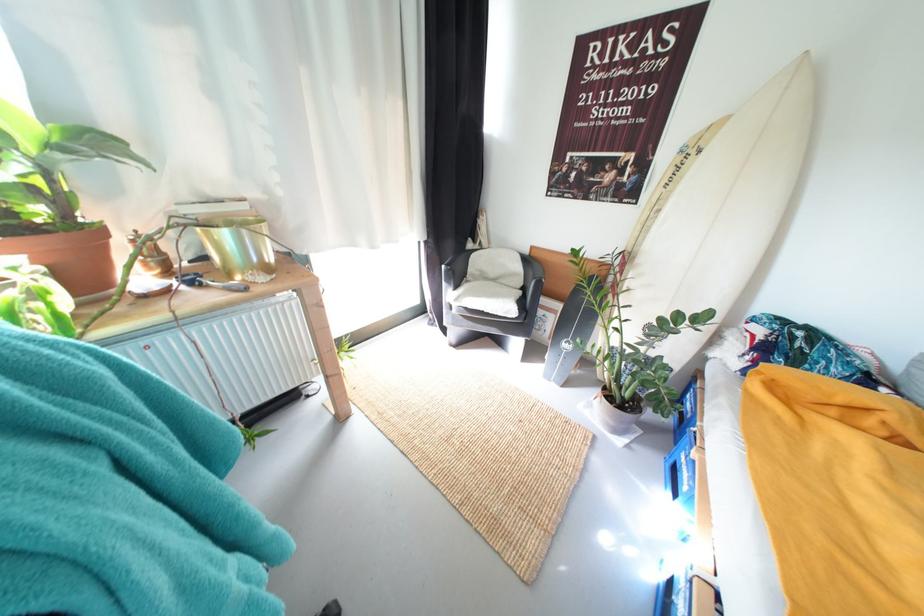
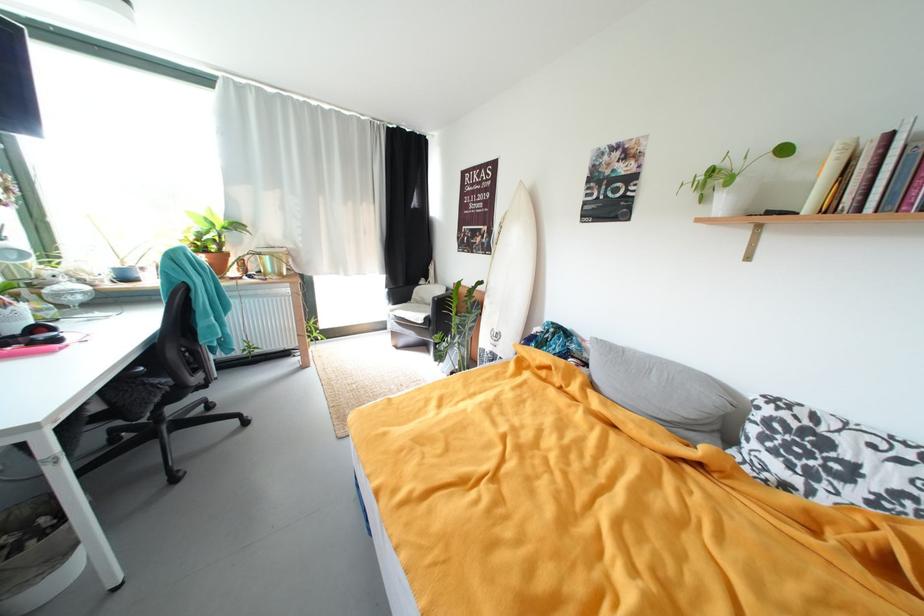
The point at [465,302] is marked in the first image. Where is the corresponding point in the second image?

(399, 313)